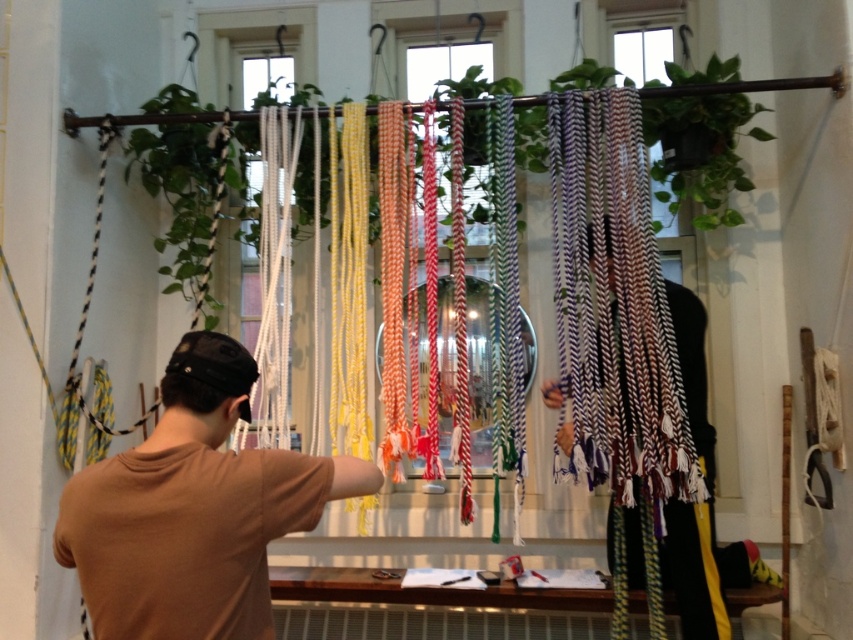
Is point (140, 586) farther from viewer compared to point (714, 605)?

No, (140, 586) is closer to viewer.

Based on the photo, does brown cotton t-shirt at center appear on the left side of multicolored woven rope at center?

Indeed, brown cotton t-shirt at center is positioned on the left side of multicolored woven rope at center.

Where is `brown cotton t-shirt at center`? The height and width of the screenshot is (640, 853). brown cotton t-shirt at center is located at coordinates (193, 509).